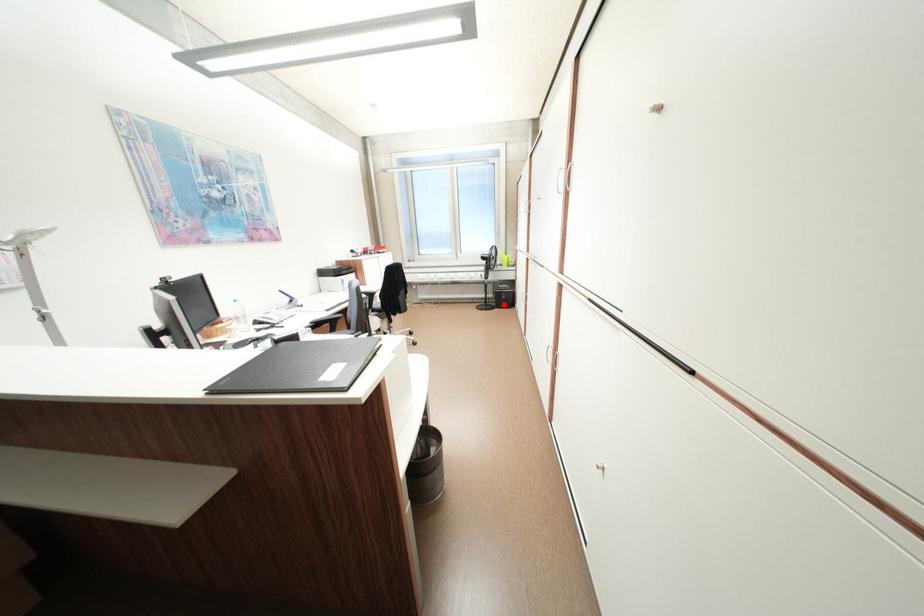
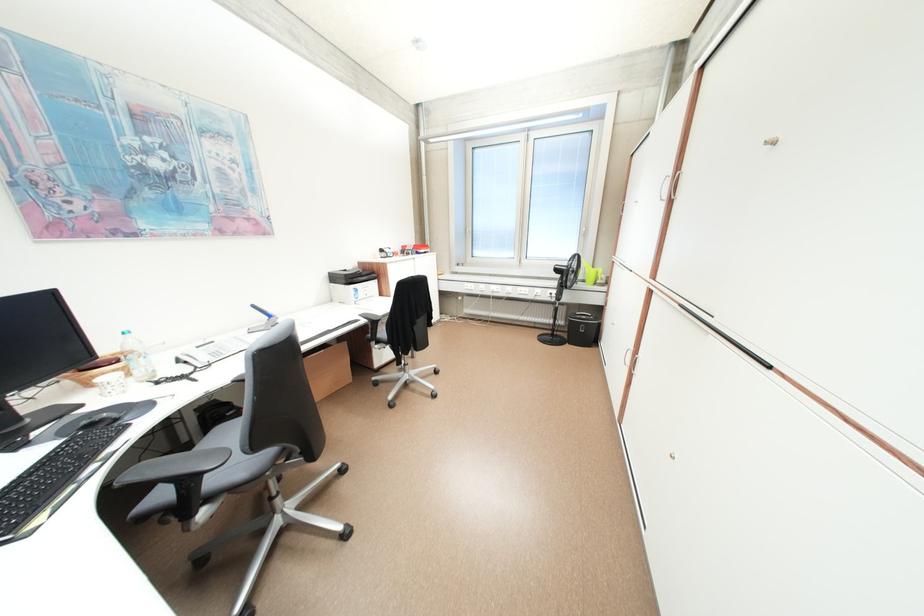
Find the pixel in the second image that matches the highlighted location in the first image.

(576, 337)